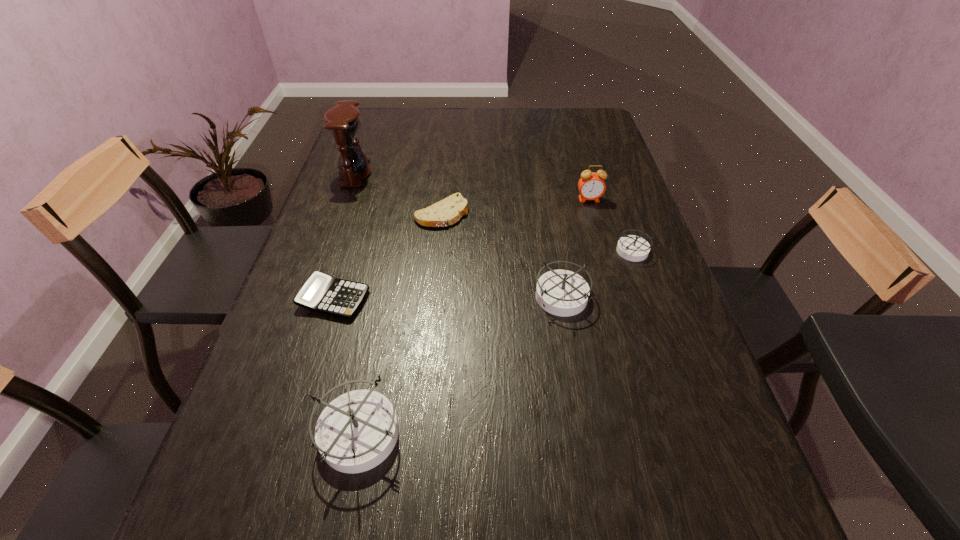
The width and height of the screenshot is (960, 540). In order to click on the nearest object in this screenshot , I will do `click(357, 431)`.

Identify the location of the leftmost compass. The image size is (960, 540). (357, 431).

The height and width of the screenshot is (540, 960). Identify the location of the second compass from left to right. (564, 293).

The image size is (960, 540). Identify the location of the fourth shortest object. (564, 293).

Image resolution: width=960 pixels, height=540 pixels. In order to click on the rightmost compass in this screenshot , I will do `click(634, 248)`.

At what (x,y) coordinates should I click in order to perform the action: click on the farthest compass. Please return your answer as a coordinate pair (x, y). This screenshot has height=540, width=960. Looking at the image, I should click on coord(634,248).

This screenshot has width=960, height=540. I want to click on pita bread, so 448,211.

The width and height of the screenshot is (960, 540). Find the location of `calculator`. calculator is located at coordinates (321, 293).

Where is `the farthest object`? The image size is (960, 540). the farthest object is located at coordinates (343, 121).

Find the location of a particular element. The height and width of the screenshot is (540, 960). the tallest object is located at coordinates (343, 121).